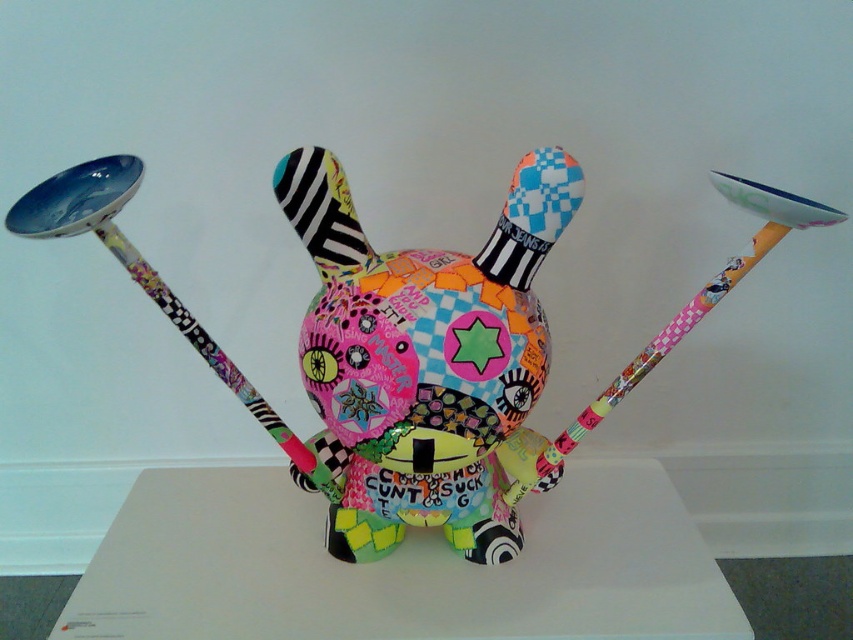
Question: Among these objects, which one is farthest from the camera?

Choices:
 (A) multicolored collage art toy at center
 (B) multicolored fabric toy at center

Answer: (A)

Question: Can you confirm if multicolored fabric toy at center is positioned to the right of multicolored collage art toy at center?

Choices:
 (A) no
 (B) yes

Answer: (A)

Question: Where is multicolored fabric toy at center located in relation to multicolored collage art toy at center in the image?

Choices:
 (A) right
 (B) left

Answer: (B)

Question: Does multicolored fabric toy at center come in front of multicolored collage art toy at center?

Choices:
 (A) no
 (B) yes

Answer: (B)